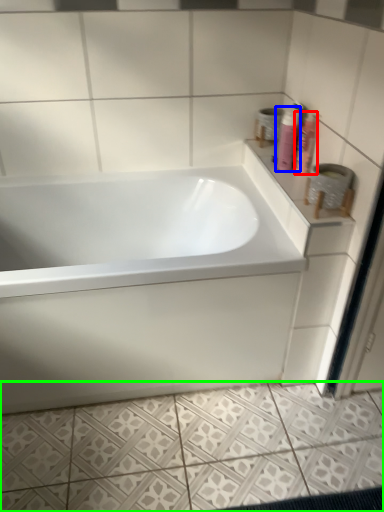
Question: Based on their relative distances, which object is farther from shaving cream (highlighted by a red box)? Choose from shaving cream (highlighted by a blue box) and ceramic tile (highlighted by a green box).

Choices:
 (A) shaving cream
 (B) ceramic tile

Answer: (B)